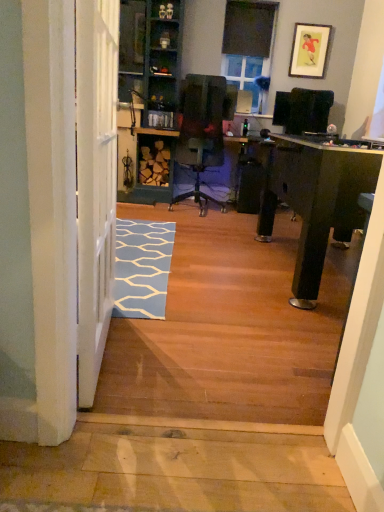
Question: Is blue carpet at lower left inside black matte window screen at upper center, which is the 2th window screen in bottom-to-top order?

Choices:
 (A) no
 (B) yes

Answer: (A)

Question: Is black matte window screen at upper center, the first window screen positioned from the front, positioned in front of blue carpet at lower left?

Choices:
 (A) yes
 (B) no

Answer: (B)

Question: Is black matte window screen at upper center, arranged as the first window screen when viewed from the top, further to the viewer compared to blue carpet at lower left?

Choices:
 (A) no
 (B) yes

Answer: (B)

Question: Does black matte window screen at upper center, which is the 2th window screen in bottom-to-top order, appear on the left side of blue carpet at lower left?

Choices:
 (A) yes
 (B) no

Answer: (B)

Question: From the image's perspective, is black matte window screen at upper center, the first window screen positioned from the front, below blue carpet at lower left?

Choices:
 (A) no
 (B) yes

Answer: (A)

Question: In terms of size, does black matte window screen at upper center, the second window screen when ordered from back to front, appear bigger or smaller than green painted wood bookshelf at center?

Choices:
 (A) big
 (B) small

Answer: (B)

Question: Is black matte window screen at upper center, the first window screen positioned from the front, inside or outside of green painted wood bookshelf at center?

Choices:
 (A) inside
 (B) outside

Answer: (B)

Question: Is point (253, 26) positioned closer to the camera than point (163, 88)?

Choices:
 (A) farther
 (B) closer

Answer: (A)

Question: Considering their positions, is black matte window screen at upper center, which is the 2th window screen in bottom-to-top order, located in front of or behind green painted wood bookshelf at center?

Choices:
 (A) front
 (B) behind

Answer: (B)

Question: From a real-world perspective, is green painted wood bookshelf at center above or below blue carpet at lower left?

Choices:
 (A) above
 (B) below

Answer: (A)

Question: From the image's perspective, is green painted wood bookshelf at center positioned above or below blue carpet at lower left?

Choices:
 (A) above
 (B) below

Answer: (A)

Question: Would you say green painted wood bookshelf at center is inside or outside blue carpet at lower left?

Choices:
 (A) inside
 (B) outside

Answer: (B)

Question: Is green painted wood bookshelf at center taller or shorter than blue carpet at lower left?

Choices:
 (A) tall
 (B) short

Answer: (A)

Question: Which is correct: blue carpet at lower left is inside matte gold picture frame at upper right, or outside of it?

Choices:
 (A) inside
 (B) outside

Answer: (B)

Question: Is blue carpet at lower left in front of or behind matte gold picture frame at upper right in the image?

Choices:
 (A) behind
 (B) front

Answer: (B)